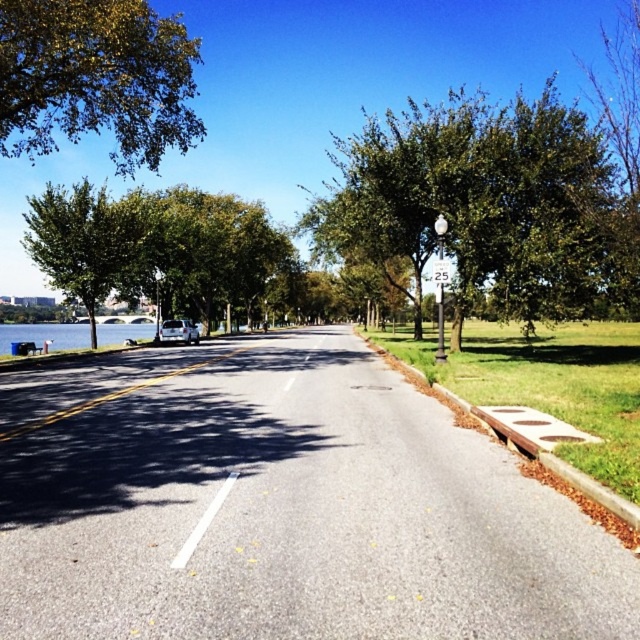
You are a delivery driver who needs to park your truck on the sidewalk. The truck is 2 meters wide. You see the green leafy tree at upper left and the white plastic sign at center. Which object is wider, and can your truck fit between them?

The green leafy tree at upper left is wider than the white plastic sign at center. Since the truck is 2 meters wide, and the tree is wider than the sign, but the exact width isn